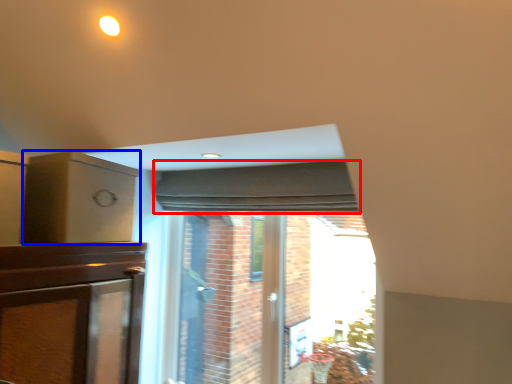
Question: Among these objects, which one is farthest to the camera, curtain (highlighted by a red box) or cabinetry (highlighted by a blue box)?

Choices:
 (A) curtain
 (B) cabinetry

Answer: (A)